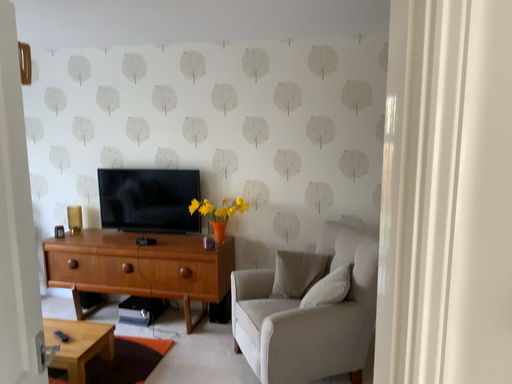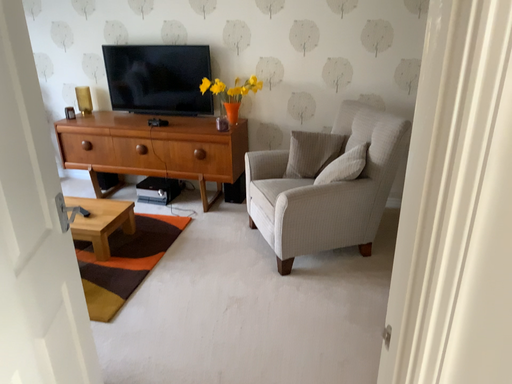
Question: How did the camera likely rotate when shooting the video?

Choices:
 (A) rotated downward
 (B) rotated upward

Answer: (A)